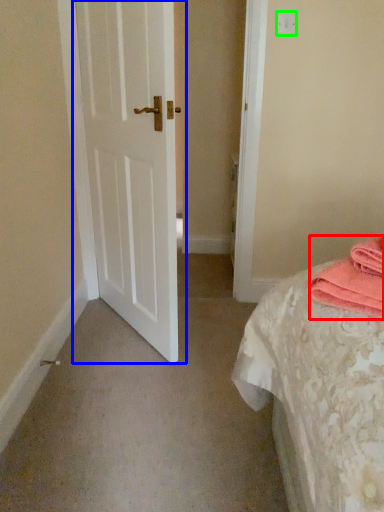
Question: Based on their relative distances, which object is farther from material (highlighted by a red box)? Choose from door (highlighted by a blue box) and light switch (highlighted by a green box).

Choices:
 (A) door
 (B) light switch

Answer: (B)